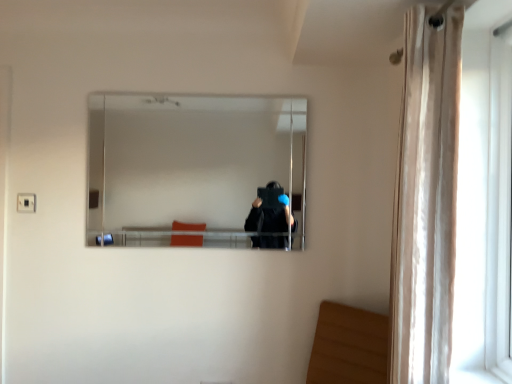
Where is `white plastic screen door at right`? Image resolution: width=512 pixels, height=384 pixels. white plastic screen door at right is located at coordinates (499, 208).

Where is `beige sheer curtain at right`? The height and width of the screenshot is (384, 512). beige sheer curtain at right is located at coordinates pos(426,200).

This screenshot has height=384, width=512. What do you see at coordinates (196, 171) in the screenshot?
I see `clear glass mirror at center` at bounding box center [196, 171].

Locate an element on the screen. The width and height of the screenshot is (512, 384). clear glass mirror at center is located at coordinates (196, 171).

Locate an element on the screen. This screenshot has height=384, width=512. white plastic screen door at right is located at coordinates (499, 208).

Do you think beige sheer curtain at right is within white plastic screen door at right, or outside of it?

beige sheer curtain at right cannot be found inside white plastic screen door at right.

From the image's perspective, which is below, beige sheer curtain at right or white plastic screen door at right?

beige sheer curtain at right, from the image's perspective.

Considering the sizes of beige sheer curtain at right and white plastic screen door at right in the image, is beige sheer curtain at right bigger or smaller than white plastic screen door at right?

Clearly, beige sheer curtain at right is larger in size than white plastic screen door at right.

Is beige sheer curtain at right thinner than white plastic screen door at right?

Incorrect, the width of beige sheer curtain at right is not less than that of white plastic screen door at right.

Visually, is beige sheer curtain at right positioned to the left or to the right of clear glass mirror at center?

→ Based on their positions, beige sheer curtain at right is located to the right of clear glass mirror at center.

From a real-world perspective, between beige sheer curtain at right and clear glass mirror at center, who is vertically lower?

From a 3D spatial view, beige sheer curtain at right is below.

Does beige sheer curtain at right have a larger size compared to clear glass mirror at center?

Correct, beige sheer curtain at right is larger in size than clear glass mirror at center.

Considering the relative sizes of beige sheer curtain at right and clear glass mirror at center in the image provided, is beige sheer curtain at right shorter than clear glass mirror at center?

No, beige sheer curtain at right is not shorter than clear glass mirror at center.

Looking at the image, does clear glass mirror at center seem bigger or smaller compared to white plastic screen door at right?

In the image, clear glass mirror at center appears to be smaller than white plastic screen door at right.

From a real-world perspective, is clear glass mirror at center on white plastic screen door at right?

Yes.

How different are the orientations of clear glass mirror at center and white plastic screen door at right in degrees?

90.2 degrees separate the facing orientations of clear glass mirror at center and white plastic screen door at right.

Is clear glass mirror at center facing towards white plastic screen door at right?

No, clear glass mirror at center does not turn towards white plastic screen door at right.

The width and height of the screenshot is (512, 384). In order to click on curtain located in front of the clear glass mirror at center in this screenshot , I will do `click(426, 200)`.

Who is taller, clear glass mirror at center or beige sheer curtain at right?

beige sheer curtain at right.

Which is correct: clear glass mirror at center is inside beige sheer curtain at right, or outside of it?

clear glass mirror at center is not inside beige sheer curtain at right, it's outside.

Can you tell me how much white plastic screen door at right and clear glass mirror at center differ in facing direction?

The facing directions of white plastic screen door at right and clear glass mirror at center are 90.2 degrees apart.

From the image's perspective, is white plastic screen door at right located above or below clear glass mirror at center?

Based on their image positions, white plastic screen door at right is located beneath clear glass mirror at center.

Consider the image. Is white plastic screen door at right positioned with its back to clear glass mirror at center?

white plastic screen door at right does not have its back to clear glass mirror at center.

Does white plastic screen door at right have a greater width compared to clear glass mirror at center?

Yes, white plastic screen door at right is wider than clear glass mirror at center.

Is white plastic screen door at right not near beige sheer curtain at right?

That's not correct — white plastic screen door at right is a little close to beige sheer curtain at right.

Is white plastic screen door at right positioned with its back to beige sheer curtain at right?

white plastic screen door at right does not have its back to beige sheer curtain at right.

Is white plastic screen door at right situated inside beige sheer curtain at right or outside?

white plastic screen door at right is spatially situated outside beige sheer curtain at right.

Can you tell me how much white plastic screen door at right and beige sheer curtain at right differ in facing direction?

0.342 degrees separate the facing orientations of white plastic screen door at right and beige sheer curtain at right.

Identify the location of screen door that is above the beige sheer curtain at right (from the image's perspective). This screenshot has width=512, height=384. (499, 208).

Identify the location of curtain that appears in front of the clear glass mirror at center. (x=426, y=200).

Which object lies nearer to the anchor point white plastic screen door at right, beige sheer curtain at right or clear glass mirror at center?

Among the two, beige sheer curtain at right is located nearer to white plastic screen door at right.

From the picture: Which object lies further to the anchor point clear glass mirror at center, beige sheer curtain at right or white plastic screen door at right?

white plastic screen door at right is further to clear glass mirror at center.

Considering their positions, is white plastic screen door at right positioned further to beige sheer curtain at right than clear glass mirror at center?

clear glass mirror at center is further to beige sheer curtain at right.

Estimate the real-world distances between objects in this image. Which object is closer to clear glass mirror at center, white plastic screen door at right or beige sheer curtain at right?

The object closer to clear glass mirror at center is beige sheer curtain at right.

Estimate the real-world distances between objects in this image. Which object is closer to white plastic screen door at right, clear glass mirror at center or beige sheer curtain at right?

Based on the image, beige sheer curtain at right appears to be nearer to white plastic screen door at right.

Looking at the image, which one is located further to beige sheer curtain at right, clear glass mirror at center or white plastic screen door at right?

clear glass mirror at center lies further to beige sheer curtain at right than the other object.

The height and width of the screenshot is (384, 512). I want to click on curtain between clear glass mirror at center and white plastic screen door at right from left to right, so click(x=426, y=200).